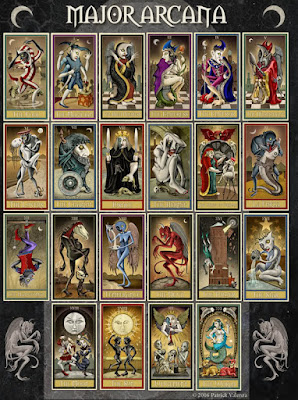
The height and width of the screenshot is (400, 298). What are the coordinates of `black/charcoal marble bacground` in the screenshot? It's located at (46, 16).